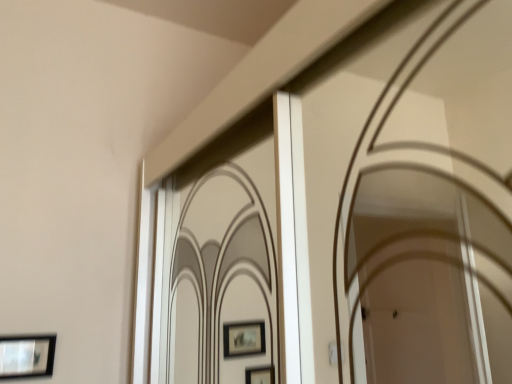
Image resolution: width=512 pixels, height=384 pixels. What do you see at coordinates (26, 356) in the screenshot?
I see `matte black picture frame at lower left` at bounding box center [26, 356].

The width and height of the screenshot is (512, 384). Identify the location of matte black picture frame at lower left. (26, 356).

Locate an element on the screen. This screenshot has height=384, width=512. matte black picture frame at lower left is located at coordinates (26, 356).